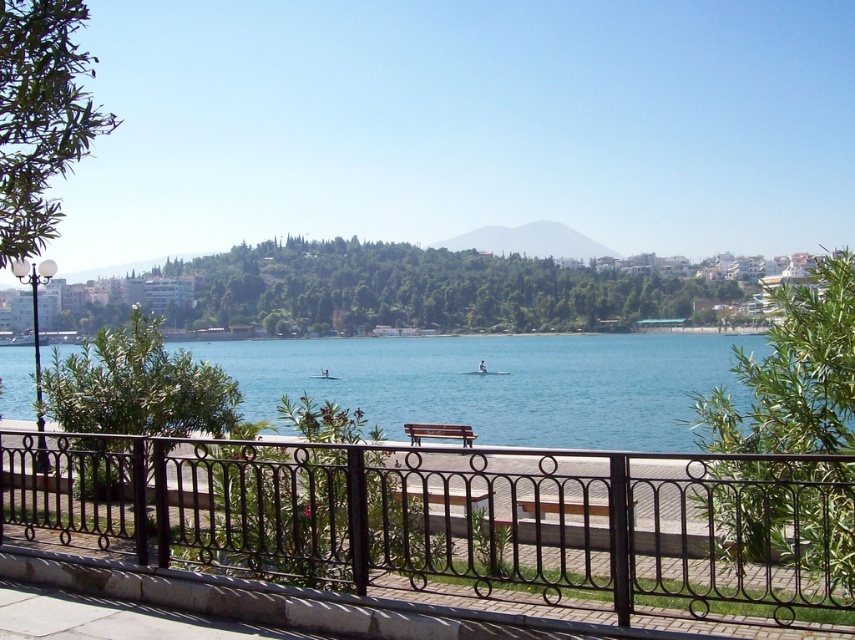
Question: Which of these objects is positioned farthest from the wooden bench at center?

Choices:
 (A) black wrought iron fence at center
 (B) blue water at center

Answer: (B)

Question: Does black wrought iron fence at center lie behind blue water at center?

Choices:
 (A) yes
 (B) no

Answer: (B)

Question: Which of the following is the closest to the observer?

Choices:
 (A) (817, 508)
 (B) (453, 435)
 (C) (629, 392)

Answer: (A)

Question: Does blue water at center appear on the right side of wooden bench at center?

Choices:
 (A) yes
 (B) no

Answer: (A)

Question: Does black wrought iron fence at center have a lesser width compared to wooden bench at center?

Choices:
 (A) yes
 (B) no

Answer: (B)

Question: Which point is closer to the camera?

Choices:
 (A) (641, 371)
 (B) (741, 596)

Answer: (B)